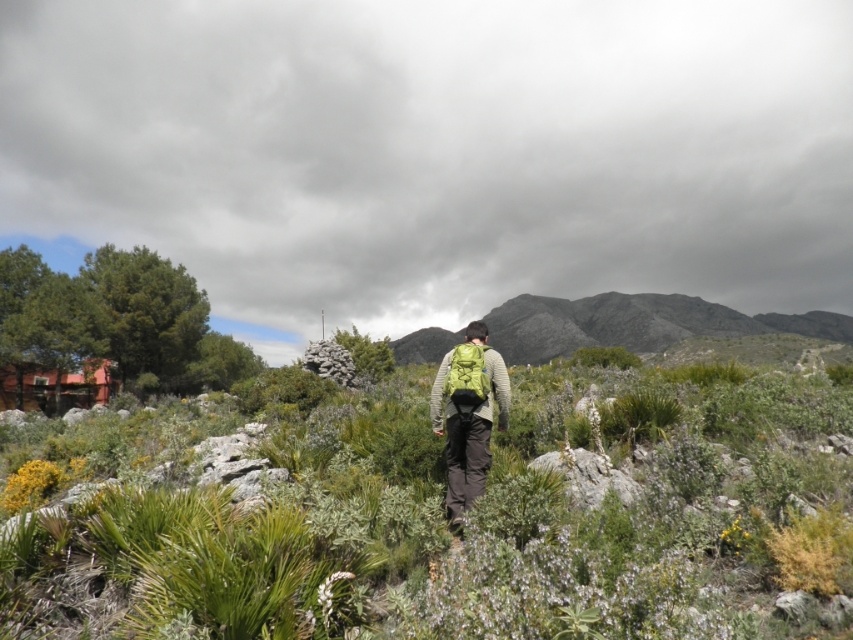
Question: Does gray rocky mountain at center have a lesser width compared to green fabric backpack at center?

Choices:
 (A) yes
 (B) no

Answer: (B)

Question: Among these objects, which one is farthest from the camera?

Choices:
 (A) green fabric backpack at center
 (B) gray rocky mountain at center

Answer: (B)

Question: Among these points, which one is nearest to the camera?

Choices:
 (A) (798, 316)
 (B) (483, 467)

Answer: (B)

Question: Can you confirm if gray rocky mountain at center is wider than green fabric backpack at center?

Choices:
 (A) yes
 (B) no

Answer: (A)

Question: Can you confirm if gray rocky mountain at center is smaller than green fabric backpack at center?

Choices:
 (A) yes
 (B) no

Answer: (B)

Question: Which point is closer to the camera?

Choices:
 (A) (466, 344)
 (B) (650, 301)

Answer: (A)